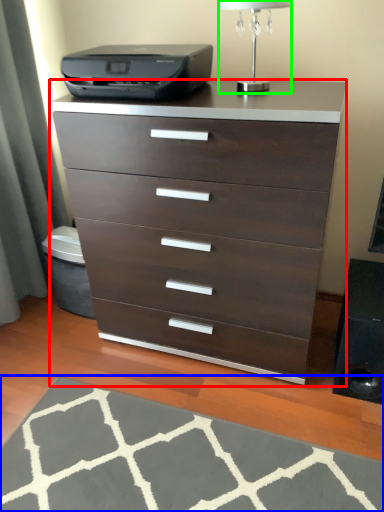
Question: Estimate the real-world distances between objects in this image. Which object is closer to chest of drawers (highlighted by a red box), doormat (highlighted by a blue box) or table lamp (highlighted by a green box)?

Choices:
 (A) doormat
 (B) table lamp

Answer: (A)